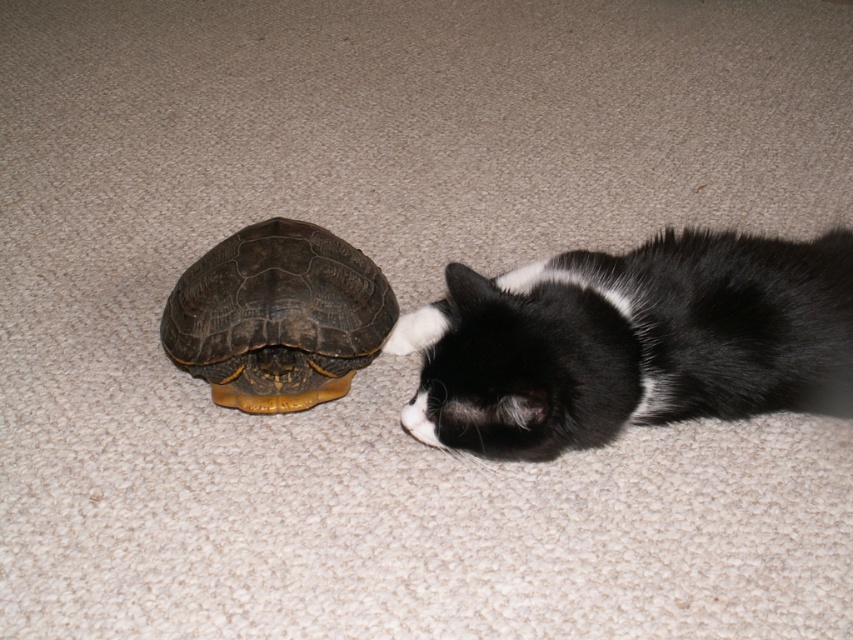
Question: Which point is farther from the camera taking this photo?

Choices:
 (A) (196, 272)
 (B) (465, 280)

Answer: (A)

Question: Can you confirm if black fur cat at right is positioned above brown textured shell at center?

Choices:
 (A) yes
 (B) no

Answer: (A)

Question: Which of the following is the closest to the observer?

Choices:
 (A) brown textured shell at center
 (B) black fur cat at right

Answer: (B)

Question: Is black fur cat at right thinner than brown textured shell at center?

Choices:
 (A) no
 (B) yes

Answer: (A)

Question: In this image, where is black fur cat at right located relative to brown textured shell at center?

Choices:
 (A) below
 (B) above

Answer: (B)